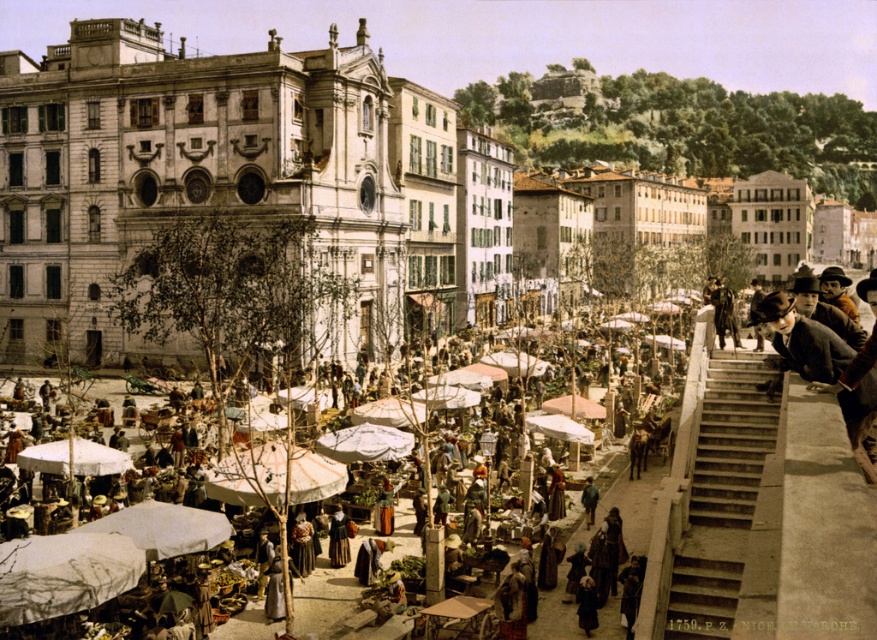
Question: Which point appears farthest from the camera in this image?

Choices:
 (A) (824, 497)
 (B) (739, 396)

Answer: (B)

Question: Can you confirm if white fabric umbrella at lower left is wider than dark brown fur coat at upper right?

Choices:
 (A) yes
 (B) no

Answer: (A)

Question: Based on their relative distances, which object is farther from the dark brown fur coat at upper right?

Choices:
 (A) gray concrete stairs at right
 (B) white fabric umbrella at lower left

Answer: (B)

Question: Is white fabric umbrella at lower left to the right of gray concrete stairs at right from the viewer's perspective?

Choices:
 (A) yes
 (B) no

Answer: (B)

Question: Is white fabric umbrella at lower left wider than dark brown fur coat at upper right?

Choices:
 (A) yes
 (B) no

Answer: (A)

Question: Which point appears closest to the camera in this image?

Choices:
 (A) (809, 614)
 (B) (724, 476)
 (C) (721, 280)

Answer: (A)